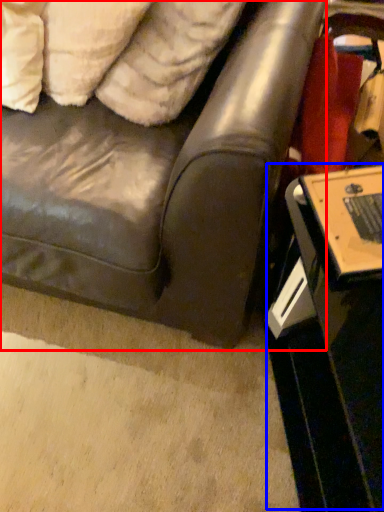
Question: Which object appears closest to the camera in this image, studio couch (highlighted by a red box) or table (highlighted by a blue box)?

Choices:
 (A) studio couch
 (B) table

Answer: (A)